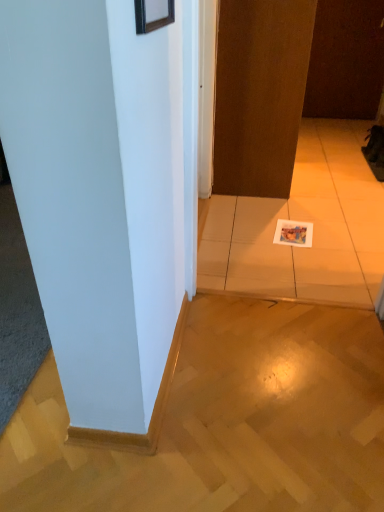
The height and width of the screenshot is (512, 384). What do you see at coordinates (260, 94) in the screenshot?
I see `brown matte door at center, placed as the 2th door when sorted from back to front` at bounding box center [260, 94].

Locate an element on the screen. wooden picture frame at upper center is located at coordinates (153, 14).

This screenshot has height=512, width=384. I want to click on brown matte door at center, placed as the first door when sorted from front to back, so [x=260, y=94].

Which object is closer to the camera taking this photo, brown matte door at center, which is the first door from left to right, or white smooth pillar at center?

white smooth pillar at center is more forward.

Considering the relative sizes of brown matte door at center, the 2th door viewed from the right, and white smooth pillar at center in the image provided, is brown matte door at center, the 2th door viewed from the right, thinner than white smooth pillar at center?

Yes.

Is the surface of brown matte door at center, placed as the first door when sorted from front to back, in direct contact with white smooth pillar at center?

No, brown matte door at center, placed as the first door when sorted from front to back, is not next to white smooth pillar at center.

In the scene shown: Is brown matte door at center, placed as the 2th door when sorted from back to front, taller or shorter than white smooth pillar at center?

Clearly, brown matte door at center, placed as the 2th door when sorted from back to front, is taller compared to white smooth pillar at center.

From the image's perspective, which one is positioned lower, brown matte door at upper right, acting as the 1th door starting from the top, or brown matte door at center, placed as the first door when sorted from front to back?

From the image's view, brown matte door at center, placed as the first door when sorted from front to back, is below.

Is brown matte door at upper right, the 2th door in the bottom-to-top sequence, not within brown matte door at center, placed as the first door when sorted from front to back?

brown matte door at upper right, the 2th door in the bottom-to-top sequence, is positioned outside brown matte door at center, placed as the first door when sorted from front to back.

Does brown matte door at upper right, which is counted as the second door, starting from the left, have a lesser width compared to brown matte door at center, placed as the 2th door when sorted from back to front?

No.

Is point (351, 44) more distant than point (258, 58)?

Yes, point (351, 44) is behind point (258, 58).

Between wooden picture frame at upper center and white smooth pillar at center, which one appears on the right side from the viewer's perspective?

From the viewer's perspective, wooden picture frame at upper center appears more on the right side.

From the image's perspective, is wooden picture frame at upper center located above or below white smooth pillar at center?

Based on their image positions, wooden picture frame at upper center is located above white smooth pillar at center.

What's the angular difference between wooden picture frame at upper center and white smooth pillar at center's facing directions?

wooden picture frame at upper center and white smooth pillar at center are facing 179 degrees away from each other.

Is wooden picture frame at upper center beside white smooth pillar at center?

No, wooden picture frame at upper center is not beside white smooth pillar at center.

Is white smooth pillar at center far away from brown matte door at center, placed as the first door when sorted from front to back?

Absolutely, white smooth pillar at center is distant from brown matte door at center, placed as the first door when sorted from front to back.

Between point (150, 108) and point (214, 176), which one is positioned behind?

The point (214, 176) is more distant.

Considering the relative positions of white smooth pillar at center and brown matte door at center, which is the first door from left to right, in the image provided, is white smooth pillar at center behind brown matte door at center, which is the first door from left to right,?

No, the depth of white smooth pillar at center is less than that of brown matte door at center, which is the first door from left to right.

Is white smooth pillar at center oriented towards brown matte door at center, placed as the first door when sorted from front to back?

No, white smooth pillar at center is not facing towards brown matte door at center, placed as the first door when sorted from front to back.

From a real-world perspective, is white smooth pillar at center physically located above or below brown matte door at upper right, acting as the 1th door starting from the top?

white smooth pillar at center is below brown matte door at upper right, acting as the 1th door starting from the top.

Could you measure the distance between white smooth pillar at center and brown matte door at upper right, which ranks as the second door in front-to-back order?

white smooth pillar at center is 3.60 meters from brown matte door at upper right, which ranks as the second door in front-to-back order.

From the image's perspective, which is below, white smooth pillar at center or brown matte door at upper right, the 1th door viewed from the back?

white smooth pillar at center, from the image's perspective.

Between white smooth pillar at center and brown matte door at upper right, the 2th door in the bottom-to-top sequence, which one has more height?

brown matte door at upper right, the 2th door in the bottom-to-top sequence, is taller.

In terms of width, does wooden picture frame at upper center look wider or thinner when compared to brown matte door at upper right, which is the 1th door from right to left?

wooden picture frame at upper center is thinner than brown matte door at upper right, which is the 1th door from right to left.

Which of these two, wooden picture frame at upper center or brown matte door at upper right, which ranks as the second door in front-to-back order, is smaller?

Smaller between the two is wooden picture frame at upper center.

From the image's perspective, does wooden picture frame at upper center appear lower than brown matte door at upper right, which is the 1th door from right to left?

Yes, from the image's perspective, wooden picture frame at upper center is below brown matte door at upper right, which is the 1th door from right to left.

Is brown matte door at upper right, the 1th door viewed from the back, in contact with wooden picture frame at upper center?

No, brown matte door at upper right, the 1th door viewed from the back, is not touching wooden picture frame at upper center.

Is brown matte door at upper right, which is the 1th door from right to left, positioned with its back to wooden picture frame at upper center?

brown matte door at upper right, which is the 1th door from right to left, does not have its back to wooden picture frame at upper center.

Who is bigger, brown matte door at upper right, the 2th door in the bottom-to-top sequence, or wooden picture frame at upper center?

brown matte door at upper right, the 2th door in the bottom-to-top sequence, is bigger.

Is the position of brown matte door at upper right, which ranks as the second door in front-to-back order, less distant than that of wooden picture frame at upper center?

That is False.

In the image, there is a brown matte door at center, placed as the 1th door when sorted from bottom to top. At what (x,y) coordinates should I click in order to perform the action: click on pillar below it (from the image's perspective). Please return your answer as a coordinate pair (x, y). The image size is (384, 512). Looking at the image, I should click on (101, 199).

What are the coordinates of `door on the left of brown matte door at upper right, acting as the 1th door starting from the top` in the screenshot? It's located at (260, 94).

Estimate the real-world distances between objects in this image. Which object is closer to white smooth pillar at center, brown matte door at center, the 2th door viewed from the right, or wooden picture frame at upper center?

wooden picture frame at upper center is positioned closer to the anchor white smooth pillar at center.

In the scene shown: Looking at the image, which one is located further to brown matte door at upper right, which ranks as the second door in front-to-back order, white smooth pillar at center or wooden picture frame at upper center?

wooden picture frame at upper center is further to brown matte door at upper right, which ranks as the second door in front-to-back order.

Based on the photo, based on their spatial positions, is wooden picture frame at upper center or white smooth pillar at center further from brown matte door at center, placed as the 2th door when sorted from back to front?

Based on the image, wooden picture frame at upper center appears to be further to brown matte door at center, placed as the 2th door when sorted from back to front.

Looking at this image, from the image, which object appears to be farther from brown matte door at upper right, the 2th door in the bottom-to-top sequence, wooden picture frame at upper center or brown matte door at center, which appears as the 2th door when viewed from the top?

wooden picture frame at upper center is positioned further to the anchor brown matte door at upper right, the 2th door in the bottom-to-top sequence.

Consider the image. When comparing their distances from brown matte door at upper right, the 2th door in the bottom-to-top sequence, does brown matte door at center, the 2th door viewed from the right, or white smooth pillar at center seem closer?

brown matte door at center, the 2th door viewed from the right, is positioned closer to the anchor brown matte door at upper right, the 2th door in the bottom-to-top sequence.

Which object lies further to the anchor point white smooth pillar at center, wooden picture frame at upper center or brown matte door at center, which appears as the 2th door when viewed from the top?

The object further to white smooth pillar at center is brown matte door at center, which appears as the 2th door when viewed from the top.

Which object lies further to the anchor point wooden picture frame at upper center, white smooth pillar at center or brown matte door at upper right, which is the 1th door from right to left?

brown matte door at upper right, which is the 1th door from right to left, lies further to wooden picture frame at upper center than the other object.

Considering their positions, is brown matte door at center, placed as the 2th door when sorted from back to front, positioned closer to white smooth pillar at center than brown matte door at upper right, acting as the 1th door starting from the top?

The object closer to white smooth pillar at center is brown matte door at center, placed as the 2th door when sorted from back to front.

This screenshot has height=512, width=384. I want to click on door located between wooden picture frame at upper center and brown matte door at upper right, the 2th door in the bottom-to-top sequence, in the depth direction, so click(260, 94).

At what (x,y) coordinates should I click in order to perform the action: click on pillar between wooden picture frame at upper center and brown matte door at center, placed as the first door when sorted from front to back, in the front-back direction. Please return your answer as a coordinate pair (x, y). This screenshot has height=512, width=384. Looking at the image, I should click on (101, 199).

Identify the location of pillar positioned between wooden picture frame at upper center and brown matte door at upper right, which ranks as the second door in front-to-back order, from near to far. This screenshot has height=512, width=384. (101, 199).

You are a GUI agent. You are given a task and a screenshot of the screen. Output one action in this format:
    pyautogui.click(x=<x>, y=<y>)
    Task: Click on the door between white smooth pillar at center and brown matte door at upper right, the 2th door in the bottom-to-top sequence, in the front-back direction
    This screenshot has height=512, width=384.
    Given the screenshot: What is the action you would take?
    pyautogui.click(x=260, y=94)